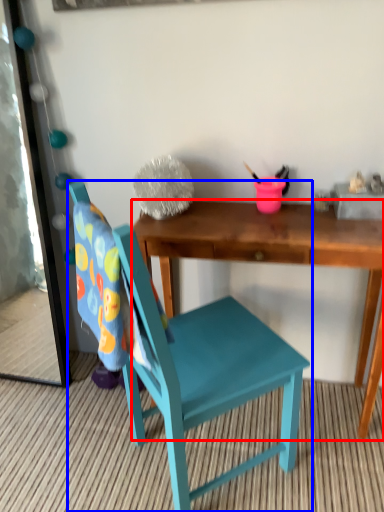
Question: Which point is closer to the camera, desk (highlighted by a red box) or chair (highlighted by a blue box)?

Choices:
 (A) desk
 (B) chair

Answer: (B)